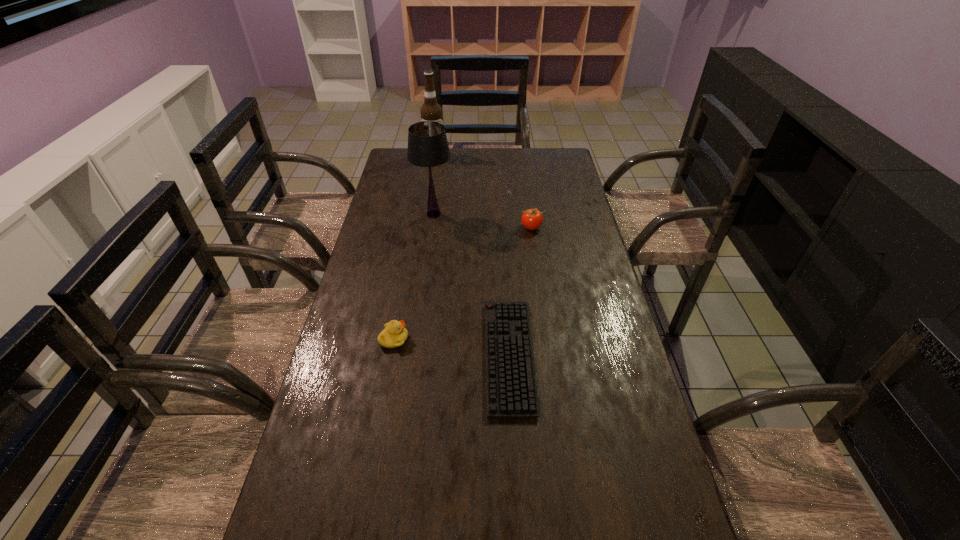
Locate which object ranks second in proximity to the tomato. Please provide its 2D coordinates. Your answer should be formatted as a tuple, i.e. [(x, y)], where the tuple contains the x and y coordinates of a point satisfying the conditions above.

[(511, 390)]

Where is `blank space that satisfies the following two spatial constraints: 1. on the front-facing side of the rightmost object; 2. on the right side of the lampshade`? Image resolution: width=960 pixels, height=540 pixels. blank space that satisfies the following two spatial constraints: 1. on the front-facing side of the rightmost object; 2. on the right side of the lampshade is located at coordinates [x=432, y=227].

Find the location of a particular element. free space that satisfies the following two spatial constraints: 1. on the label of the farthest object; 2. on the left side of the computer keyboard is located at coordinates (403, 356).

Where is `free space that satisfies the following two spatial constraints: 1. on the label of the farthest object; 2. on the left side of the rightmost object`? The image size is (960, 540). free space that satisfies the following two spatial constraints: 1. on the label of the farthest object; 2. on the left side of the rightmost object is located at coordinates (423, 227).

Locate an element on the screen. This screenshot has width=960, height=540. free spot that satisfies the following two spatial constraints: 1. on the label of the alcohol; 2. on the left side of the rightmost object is located at coordinates (423, 227).

Locate an element on the screen. This screenshot has height=540, width=960. vacant position in the image that satisfies the following two spatial constraints: 1. on the label of the farthest object; 2. on the right side of the rightmost object is located at coordinates (423, 227).

You are a GUI agent. You are given a task and a screenshot of the screen. Output one action in this format:
    pyautogui.click(x=<x>, y=<y>)
    Task: Click on the vacant point that satisfies the following two spatial constraints: 1. on the front-facing side of the shortest object; 2. on the right side of the duckling
    Image resolution: width=960 pixels, height=540 pixels.
    Given the screenshot: What is the action you would take?
    pyautogui.click(x=391, y=356)

Identify the location of free region that satisfies the following two spatial constraints: 1. on the label of the alcohol; 2. on the front-facing side of the duckling. The height and width of the screenshot is (540, 960). (406, 339).